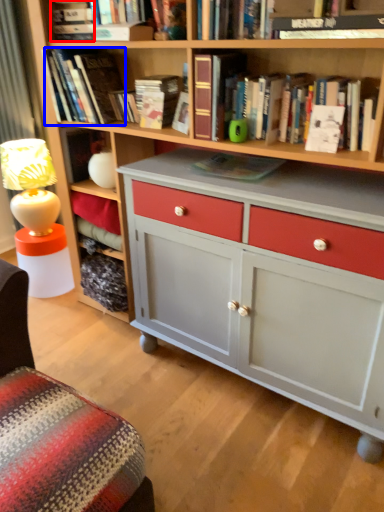
Question: Which point is closer to the camera, book (highlighted by a red box) or book (highlighted by a blue box)?

Choices:
 (A) book
 (B) book

Answer: (B)